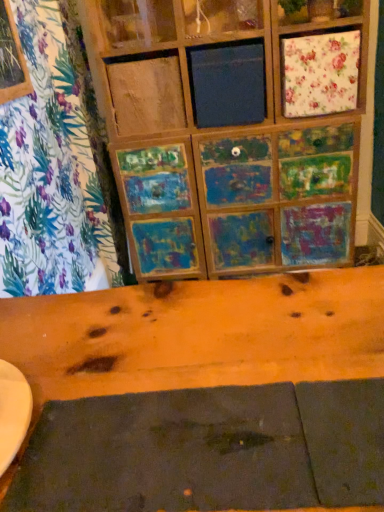
Question: Does dark matte placemat at lower center appear on the left side of floral fabric cushion at upper right?

Choices:
 (A) yes
 (B) no

Answer: (A)

Question: Does dark matte placemat at lower center have a greater width compared to floral fabric cushion at upper right?

Choices:
 (A) no
 (B) yes

Answer: (B)

Question: Is the position of dark matte placemat at lower center less distant than that of floral fabric cushion at upper right?

Choices:
 (A) no
 (B) yes

Answer: (B)

Question: From the image's perspective, is dark matte placemat at lower center below floral fabric cushion at upper right?

Choices:
 (A) yes
 (B) no

Answer: (A)

Question: Is dark matte placemat at lower center thinner than floral fabric cushion at upper right?

Choices:
 (A) no
 (B) yes

Answer: (A)

Question: From the image's perspective, is dark matte placemat at lower center on floral fabric cushion at upper right?

Choices:
 (A) no
 (B) yes

Answer: (A)

Question: Considering the relative sizes of floral fabric cushion at upper right and dark matte placemat at lower center in the image provided, is floral fabric cushion at upper right thinner than dark matte placemat at lower center?

Choices:
 (A) no
 (B) yes

Answer: (B)

Question: Is floral fabric cushion at upper right closer to the viewer compared to dark matte placemat at lower center?

Choices:
 (A) yes
 (B) no

Answer: (B)

Question: Considering the relative positions of floral fabric cushion at upper right and dark matte placemat at lower center in the image provided, is floral fabric cushion at upper right to the right of dark matte placemat at lower center from the viewer's perspective?

Choices:
 (A) yes
 (B) no

Answer: (A)

Question: Is dark matte placemat at lower center located within floral fabric cushion at upper right?

Choices:
 (A) yes
 (B) no

Answer: (B)

Question: Are floral fabric cushion at upper right and dark matte placemat at lower center far apart?

Choices:
 (A) no
 (B) yes

Answer: (B)

Question: Considering the relative positions of floral fabric cushion at upper right and dark matte placemat at lower center in the image provided, is floral fabric cushion at upper right behind dark matte placemat at lower center?

Choices:
 (A) no
 (B) yes

Answer: (B)

Question: Visually, is dark matte placemat at lower center positioned to the left or to the right of floral fabric cushion at upper right?

Choices:
 (A) right
 (B) left

Answer: (B)